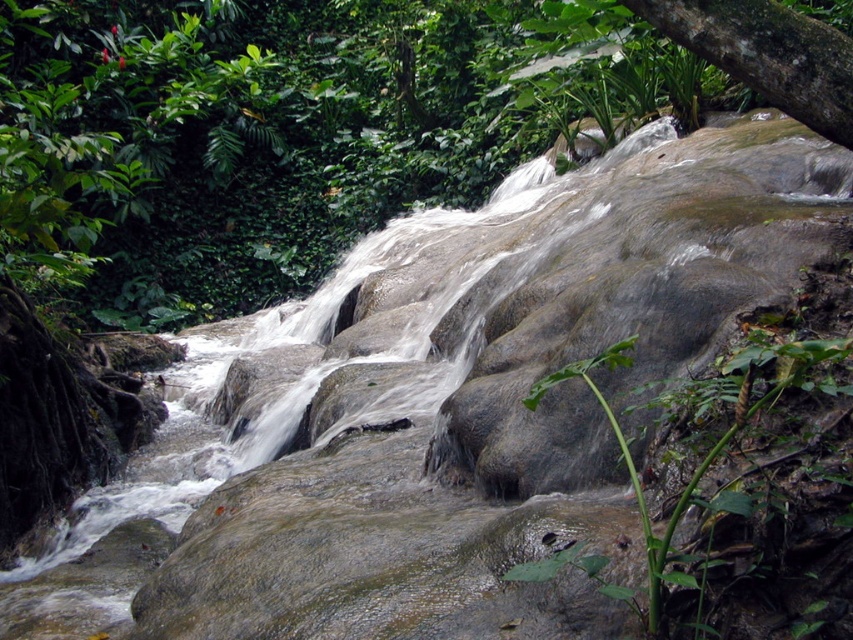
Is green rough bark tree at upper right smaller than green leafy plant at lower center?

Indeed, green rough bark tree at upper right has a smaller size compared to green leafy plant at lower center.

Between point (825, 88) and point (656, 602), which one is positioned behind?

Point (825, 88)

This screenshot has width=853, height=640. Describe the element at coordinates (767, 54) in the screenshot. I see `green rough bark tree at upper right` at that location.

Where is `green rough bark tree at upper right`? This screenshot has width=853, height=640. green rough bark tree at upper right is located at coordinates (767, 54).